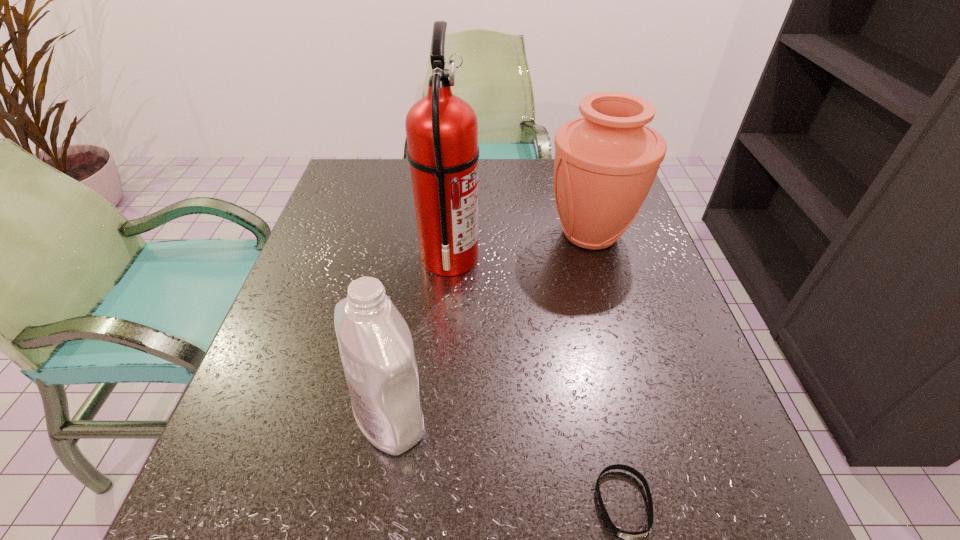
Where is `object that is the third closest to the third farthest object`? This screenshot has height=540, width=960. object that is the third closest to the third farthest object is located at coordinates (605, 163).

You are a GUI agent. You are given a task and a screenshot of the screen. Output one action in this format:
    pyautogui.click(x=<x>, y=<y>)
    Task: Click on the vacant space that satisfies the following two spatial constraints: 1. on the back side of the vase; 2. on the right side of the second nearest object
    Image resolution: width=960 pixels, height=540 pixels.
    Given the screenshot: What is the action you would take?
    click(x=420, y=234)